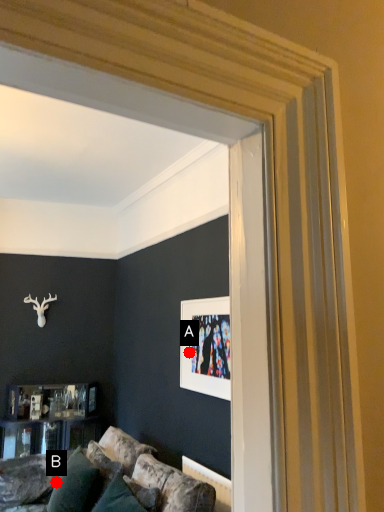
Question: Two points are circled on the image, labeled by A and B beside each circle. Among these points, which one is nearest to the camera?

Choices:
 (A) A is closer
 (B) B is closer

Answer: (B)